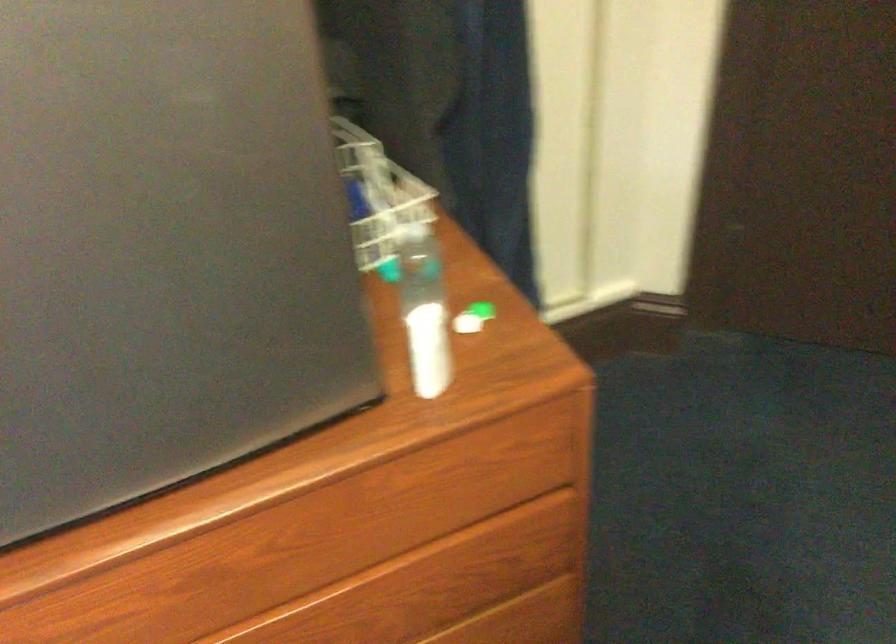
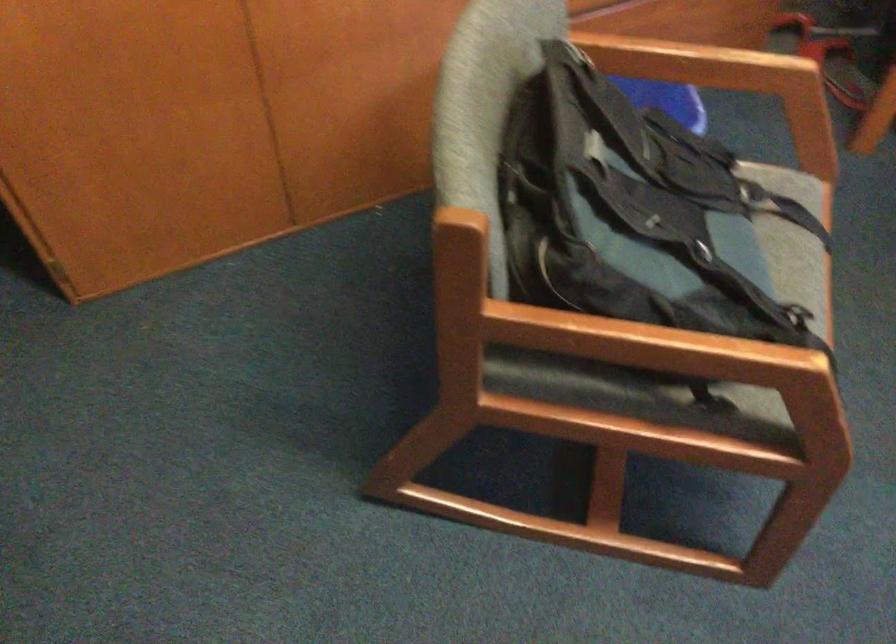
The images are taken continuously from a first-person perspective. In which direction is your viewpoint rotating?

The camera rotated toward right-down.